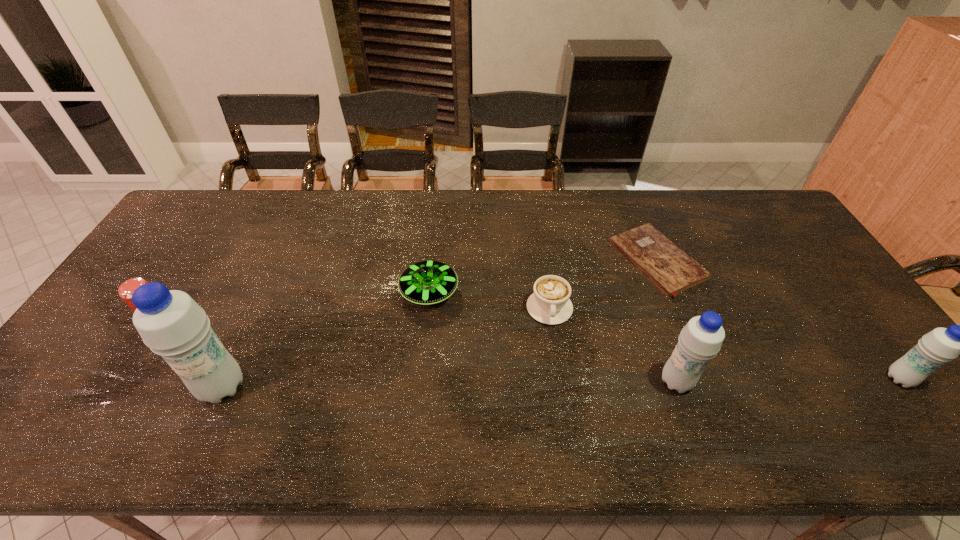
If equal spacing is desired by inserting an extra water_bottle among them, please point out a free spot for this new water_bottle. Please provide its 2D coordinates. Your answer should be formatted as a tuple, i.e. [(x, y)], where the tuple contains the x and y coordinates of a point satisfying the conditions above.

[(450, 384)]